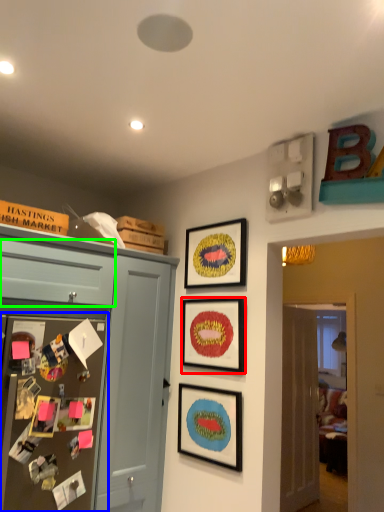
Question: Based on their relative distances, which object is nearer to picture frame (highlighted by a red box)? Choose from bulletin board (highlighted by a blue box) and drawer (highlighted by a green box).

Choices:
 (A) bulletin board
 (B) drawer

Answer: (B)